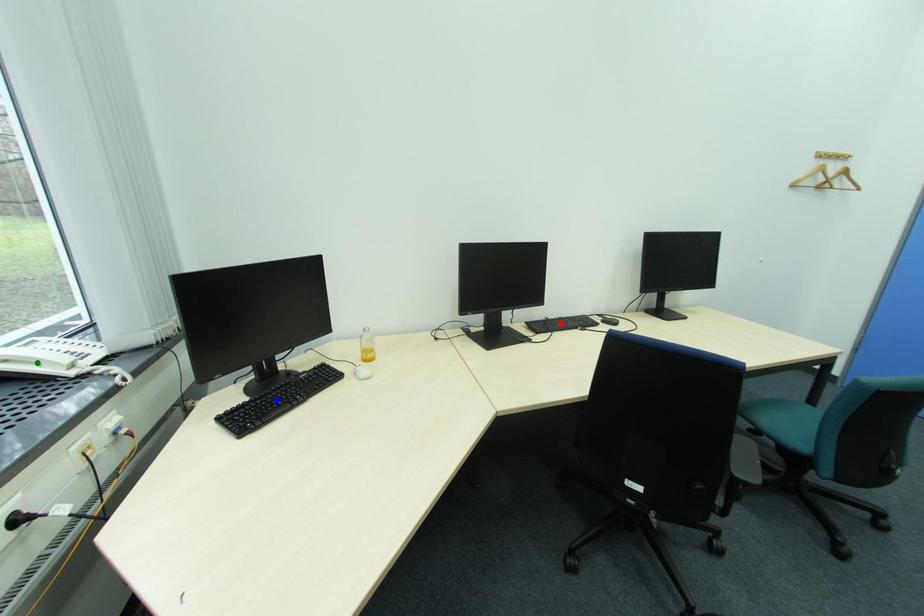
Order these from nearest to farthest:
1. green point
2. blue point
3. red point

blue point → red point → green point